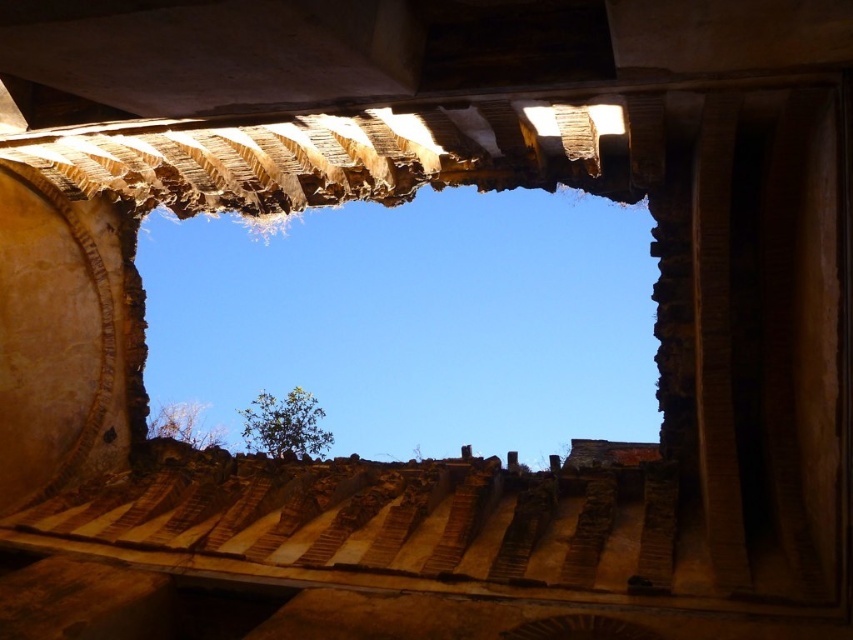
Is point (399, 445) closer to camera compared to point (601, 616)?

No.

Can you confirm if rusty stone window at center is positioned above brown textured stone at center?

Yes, rusty stone window at center is above brown textured stone at center.

Does point (619, 340) lie in front of point (503, 637)?

No, (619, 340) is further to viewer.

The image size is (853, 640). Find the location of `rusty stone window at center`. rusty stone window at center is located at coordinates (413, 321).